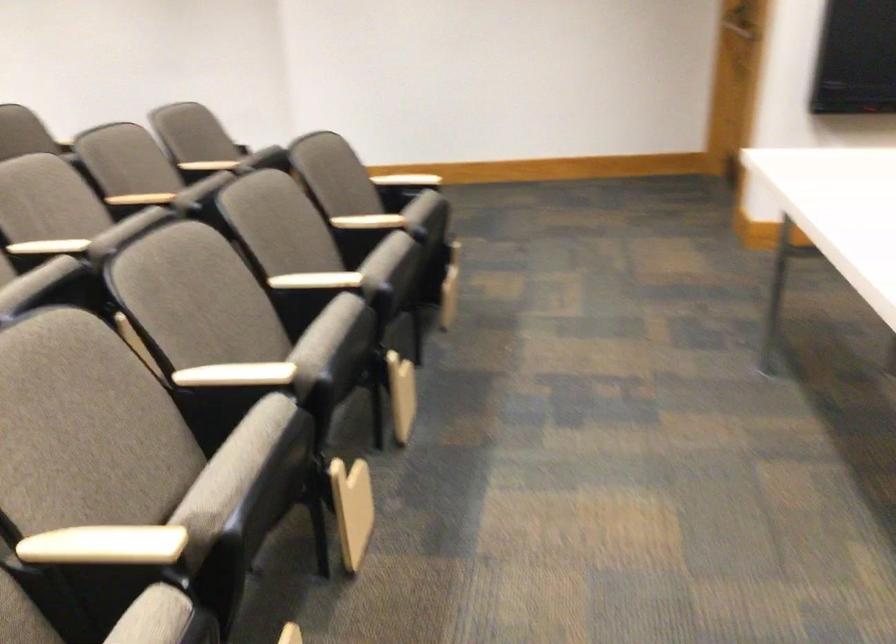
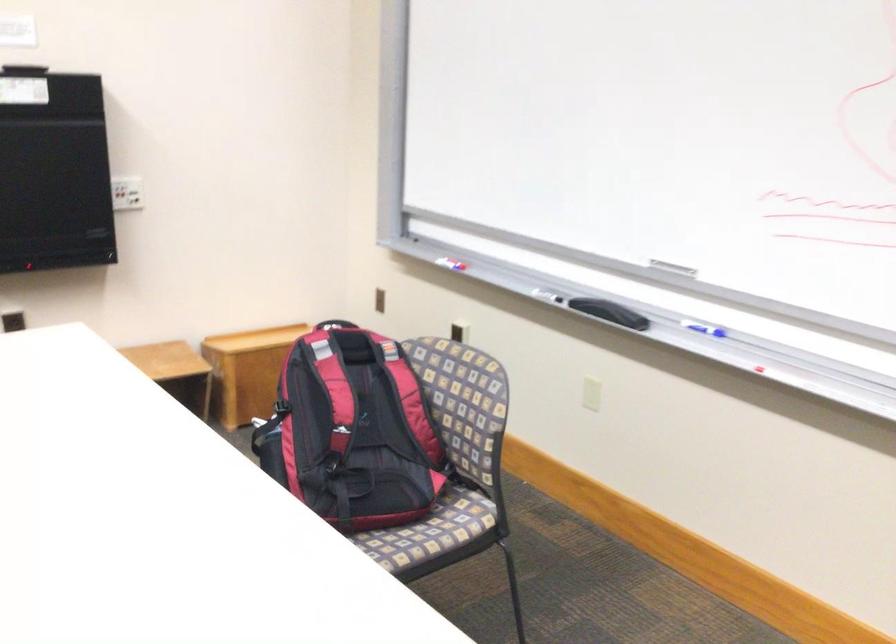
Question: The first image is from the beginning of the video and the second image is from the end. How did the camera likely rotate when shooting the video?

Choices:
 (A) Left
 (B) Right
 (C) Up
 (D) Down

Answer: (B)